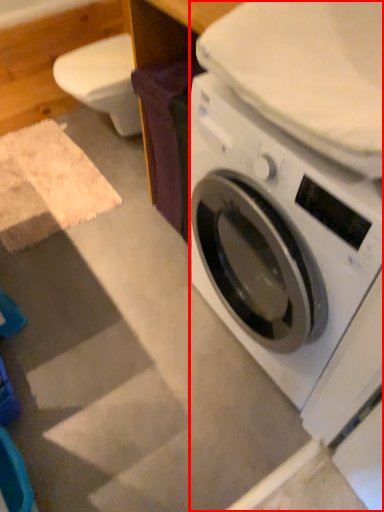
Question: Where is washing machine (annotated by the red box) located in relation to table in the image?

Choices:
 (A) left
 (B) right

Answer: (B)